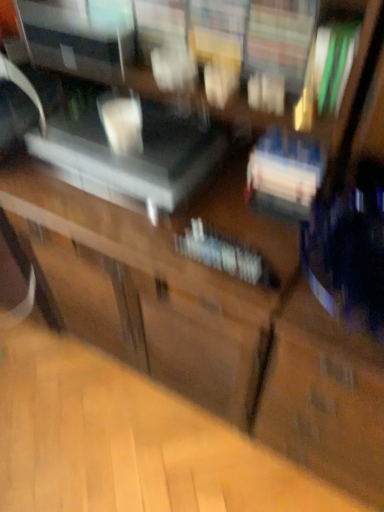
The width and height of the screenshot is (384, 512). Describe the element at coordinates (135, 154) in the screenshot. I see `satin silver speaker at center` at that location.

Find the location of a particular element. This screenshot has height=512, width=384. satin silver speaker at center is located at coordinates (135, 154).

Describe the element at coordinates (226, 255) in the screenshot. I see `white glossy book at center` at that location.

Where is `white glossy book at center`? Image resolution: width=384 pixels, height=512 pixels. white glossy book at center is located at coordinates (226, 255).

What is the approximate height of white glossy book at center?

It is 1.18 inches.

Measure the distance between point (257, 271) and camera.

Point (257, 271) is 33.66 inches from camera.

The width and height of the screenshot is (384, 512). I want to click on satin silver speaker at center, so click(x=135, y=154).

Visually, is white glossy book at center positioned to the left or to the right of satin silver speaker at center?

Clearly, white glossy book at center is on the right of satin silver speaker at center in the image.

Is the depth of white glossy book at center greater than that of satin silver speaker at center?

No, white glossy book at center is closer to the camera.

Is point (191, 255) closer to viewer compared to point (173, 122)?

Yes, point (191, 255) is in front of point (173, 122).

From the image's perspective, is white glossy book at center on satin silver speaker at center?

Actually, white glossy book at center appears below satin silver speaker at center in the image.

From a real-world perspective, does white glossy book at center sit lower than satin silver speaker at center?

Yes, from a real-world perspective, white glossy book at center is beneath satin silver speaker at center.

Based on the photo, considering the sizes of objects white glossy book at center and satin silver speaker at center in the image provided, who is wider, white glossy book at center or satin silver speaker at center?

satin silver speaker at center.

Which of these two, white glossy book at center or satin silver speaker at center, stands taller?

satin silver speaker at center is taller.

Which of these two, white glossy book at center or satin silver speaker at center, is bigger?

satin silver speaker at center is bigger.

Would you say white glossy book at center contains satin silver speaker at center?

Definitely not — satin silver speaker at center is not inside white glossy book at center.

Looking at this image, is white glossy book at center not close to satin silver speaker at center?

That's not correct — white glossy book at center is a little close to satin silver speaker at center.

Is white glossy book at center oriented towards satin silver speaker at center?

No, white glossy book at center is not aimed at satin silver speaker at center.

Measure the distance from white glossy book at center to satin silver speaker at center.

9.72 inches.

Locate an element on the screen. book lying on the right of satin silver speaker at center is located at coordinates (226, 255).

Does satin silver speaker at center appear on the left side of white glossy book at center?

Indeed, satin silver speaker at center is positioned on the left side of white glossy book at center.

Is satin silver speaker at center in front of or behind white glossy book at center in the image?

In the image, satin silver speaker at center appears behind white glossy book at center.

Is point (112, 158) more distant than point (215, 246)?

Yes, point (112, 158) is farther from viewer.

From the image's perspective, does satin silver speaker at center appear lower than white glossy book at center?

No, from the image's perspective, satin silver speaker at center is not below white glossy book at center.

From a real-world perspective, is satin silver speaker at center over white glossy book at center?

Indeed, from a real-world perspective, satin silver speaker at center stands above white glossy book at center.

Between satin silver speaker at center and white glossy book at center, which one has smaller width?

white glossy book at center is thinner.

Can you confirm if satin silver speaker at center is shorter than white glossy book at center?

In fact, satin silver speaker at center may be taller than white glossy book at center.

Is satin silver speaker at center smaller than white glossy book at center?

Incorrect, satin silver speaker at center is not smaller in size than white glossy book at center.

Is satin silver speaker at center not within white glossy book at center?

Yes, satin silver speaker at center is not within white glossy book at center.

Is satin silver speaker at center not near white glossy book at center?

That's not correct — satin silver speaker at center is a little close to white glossy book at center.

Is satin silver speaker at center looking in the opposite direction of white glossy book at center?

satin silver speaker at center is not turned away from white glossy book at center.

Can you tell me how much satin silver speaker at center and white glossy book at center differ in facing direction?

There is a 2.08-degree angle between the facing directions of satin silver speaker at center and white glossy book at center.

You are a GUI agent. You are given a task and a screenshot of the screen. Output one action in this format:
    pyautogui.click(x=<x>, y=<y>)
    Task: Click on the book below the satin silver speaker at center (from a real-world perspective)
    Image resolution: width=384 pixels, height=512 pixels.
    Given the screenshot: What is the action you would take?
    pyautogui.click(x=226, y=255)

Locate an element on the screen. This screenshot has height=512, width=384. furniture lying behind the white glossy book at center is located at coordinates (135, 154).

At what (x,y) coordinates should I click in order to perform the action: click on book located on the right of satin silver speaker at center. Please return your answer as a coordinate pair (x, y). The image size is (384, 512). Looking at the image, I should click on (226, 255).